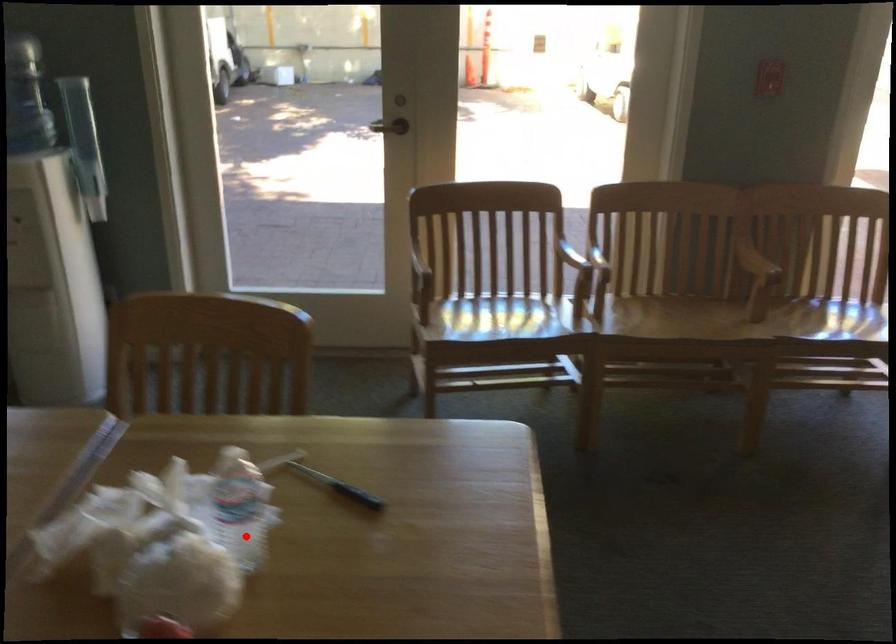
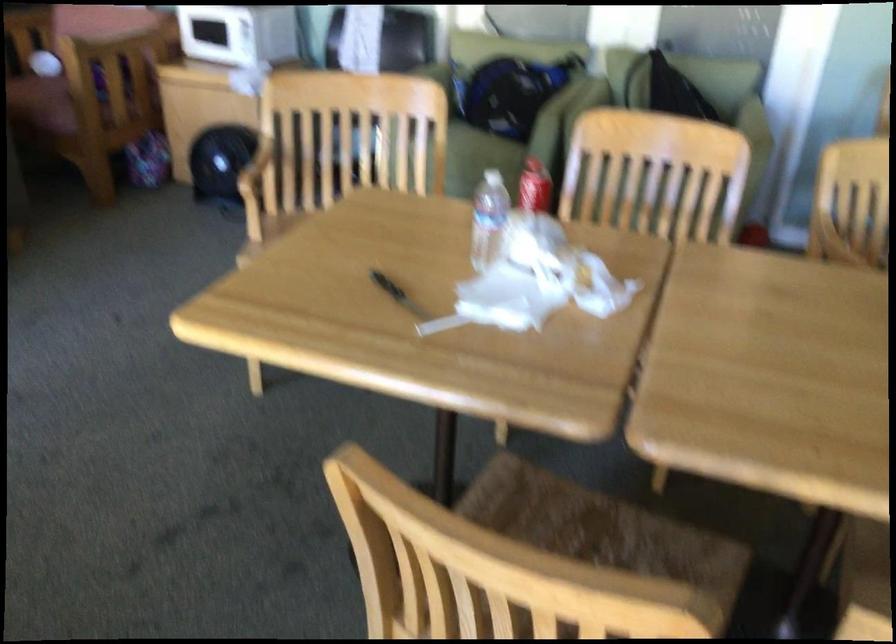
Question: I am providing you with two images of the same scene from different viewpoints. In image1, a red point is highlighted. Considering the same 3D point in image2, which of the following is correct?

Choices:
 (A) It is closer
 (B) It is farther

Answer: (B)